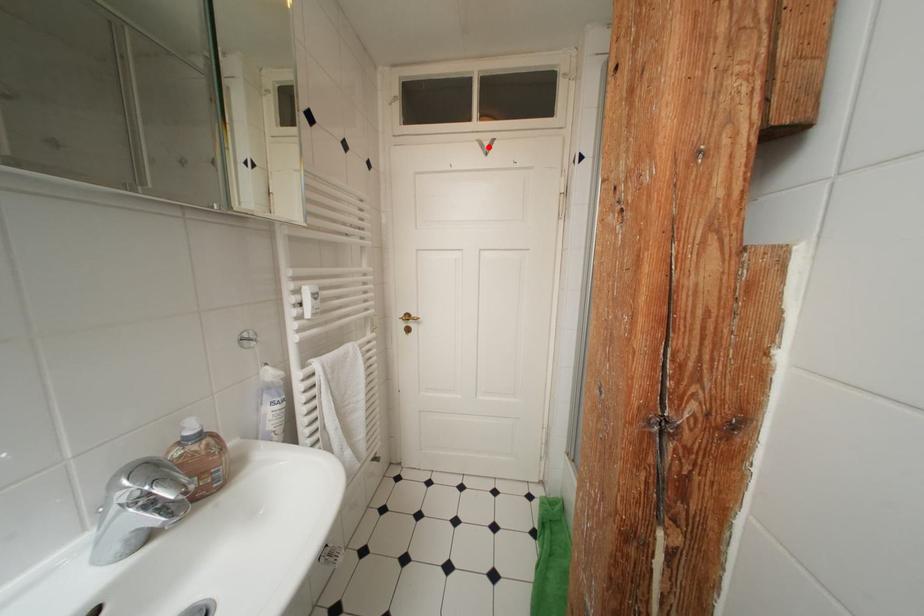
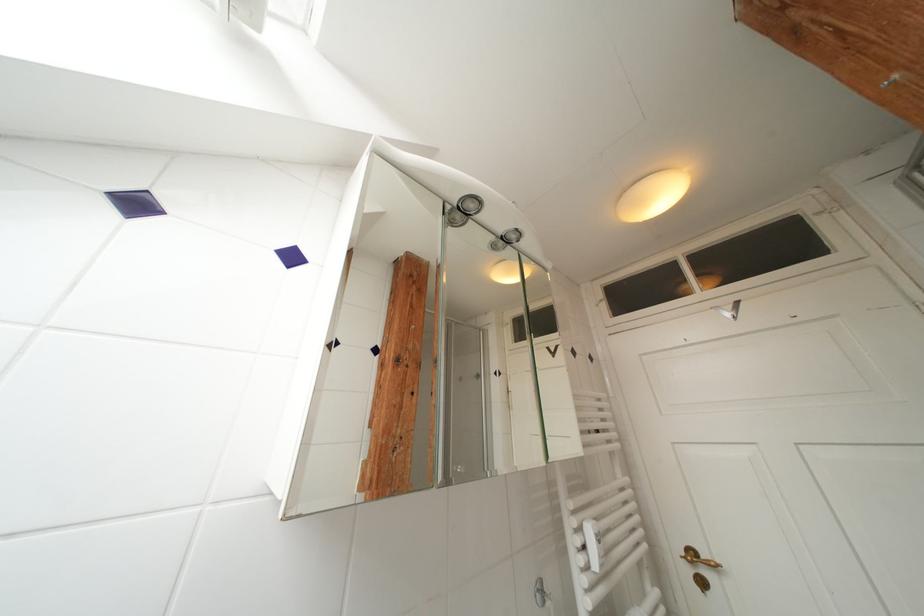
Where in the second image is the point corresponding to the highlighted location from the first image?

(724, 312)